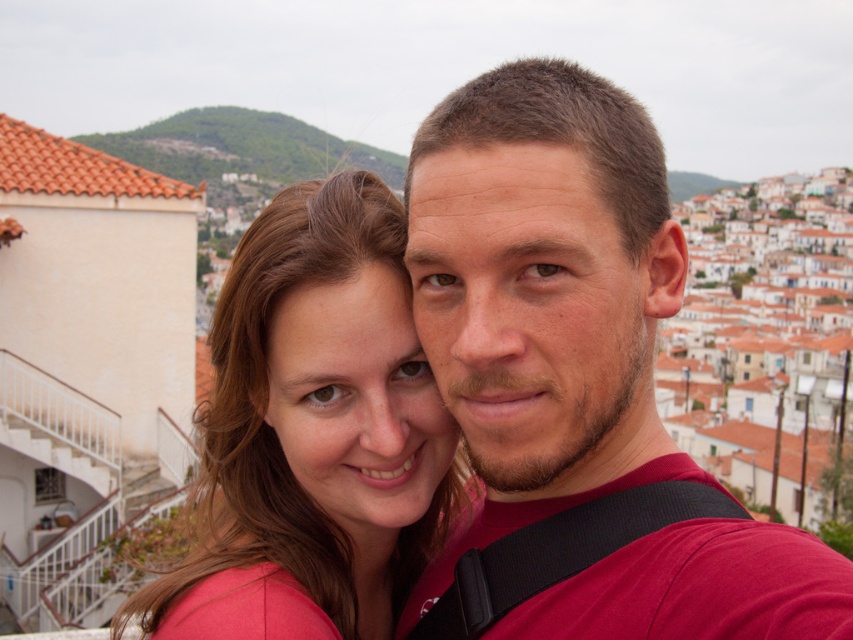
You are taking a photo of two people in front of a Mediterranean town. You notice the matte red shirt at center and the matte pink shirt at center. Which shirt is covering part of the other?

The matte red shirt at center is positioned over the matte red shirt at center, so it is covering part of the matte pink shirt at center.

You are taking a photo of two friends in front of a Mediterranean town. You notice their shirts, a matte red shirt at center and a matte pink shirt at center. Which shirt is positioned to the right side of the other?

The matte red shirt at center is to the right of the matte pink shirt at center.

What are the coordinates of the matte red shirt at center in the image?

The coordinates of the matte red shirt at center are at point (543, 291).